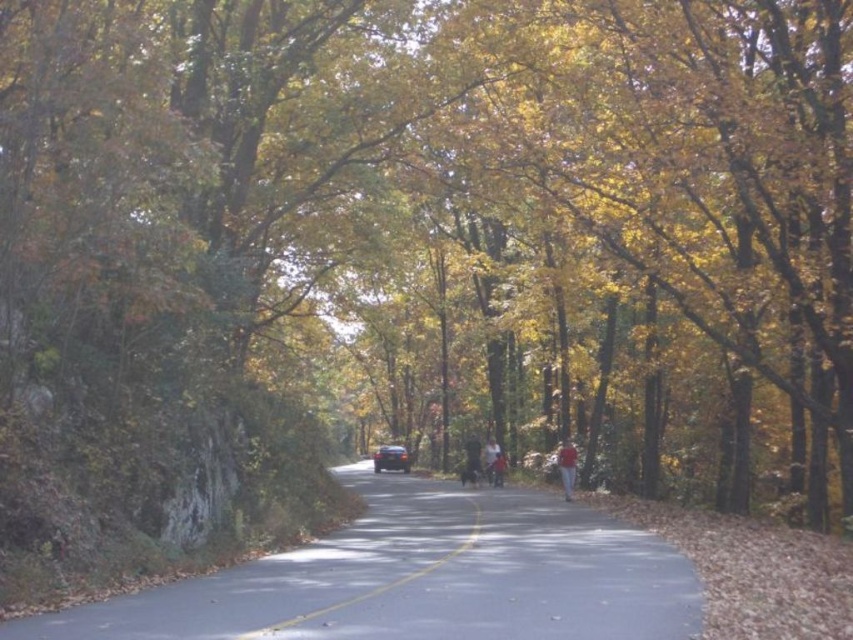
You are standing on the side of the road and see the smooth asphalt road at center and the red fabric person at center. Which object is closer to your left side?

The smooth asphalt road at center is to the left of the red fabric person at center, so the smooth asphalt road at center is closer to your left side.

You are driving a car and see the red fabric person at center and the shiny black car at center on the road. Which object is closer to you?

The red fabric person at center is closer to you because it is positioned in front of the shiny black car at center.

You are a pedestrian standing on the side of the road and see both the shiny black car at center and the dark gray fabric jacket at center. Which object is shorter in height?

The shiny black car at center is not as tall as the dark gray fabric jacket at center, so the shiny black car at center is shorter.